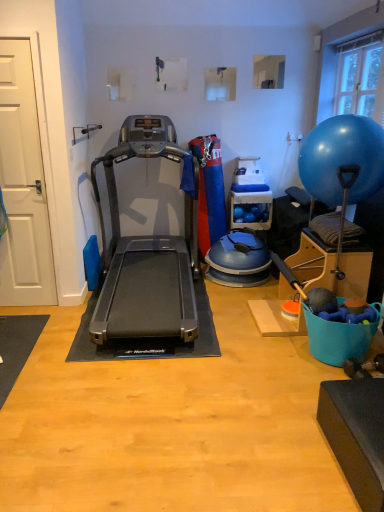
Find the location of a particular element. white matte door at left is located at coordinates (23, 183).

What is the approximate width of transparent glass window at upper right?

transparent glass window at upper right is 5.42 inches in width.

At what (x,y) coordinates should I click in order to perform the action: click on black rubber treadmill at center. Please return your answer as a coordinate pair (x, y). This screenshot has width=384, height=512. Looking at the image, I should click on (147, 249).

This screenshot has height=512, width=384. I want to click on blue rubber ball at right, so click(342, 158).

Does transparent glass window at upper right have a greater width compared to blue rubber ball at right?

In fact, transparent glass window at upper right might be narrower than blue rubber ball at right.

Who is taller, transparent glass window at upper right or blue rubber ball at right?

blue rubber ball at right is taller.

Who is smaller, transparent glass window at upper right or blue rubber ball at right?

With smaller size is transparent glass window at upper right.

From a real-world perspective, which is physically above, transparent glass window at upper right or blue rubber ball at right?

transparent glass window at upper right.

From the image's perspective, is blue rubber ball at right above or below white matte door at left?

Clearly, from the image's perspective, blue rubber ball at right is above white matte door at left.

From the picture: Is blue rubber ball at right not near white matte door at left?

That's right, there is a large distance between blue rubber ball at right and white matte door at left.

Would you say blue rubber ball at right is inside or outside white matte door at left?

blue rubber ball at right is spatially situated outside white matte door at left.

Based on the photo, is blue rubber ball at right in front of or behind white matte door at left in the image?

Visually, blue rubber ball at right is located in front of white matte door at left.

Who is shorter, black rubber treadmill at center or white matte door at left?

black rubber treadmill at center.

Is black rubber treadmill at center positioned beyond the bounds of white matte door at left?

black rubber treadmill at center lies outside white matte door at left's area.

In terms of size, does black rubber treadmill at center appear bigger or smaller than white matte door at left?

Clearly, black rubber treadmill at center is larger in size than white matte door at left.

Which is more to the right, black rubber treadmill at center or white matte door at left?

black rubber treadmill at center.

In the scene shown: Does blue rubber ball at right have a smaller size compared to transparent glass window at upper right?

Incorrect, blue rubber ball at right is not smaller in size than transparent glass window at upper right.

Which is nearer, (299, 174) or (335, 111)?

Point (299, 174)

From the picture: Does blue rubber ball at right have a greater height compared to transparent glass window at upper right?

Yes, blue rubber ball at right is taller than transparent glass window at upper right.

From the image's perspective, does blue rubber ball at right appear higher than transparent glass window at upper right?

No, from the image's perspective, blue rubber ball at right is not above transparent glass window at upper right.

Is transparent glass window at upper right not inside white matte door at left?

Yes, transparent glass window at upper right is outside of white matte door at left.

From the image's perspective, which object appears higher, transparent glass window at upper right or white matte door at left?

transparent glass window at upper right.

Is transparent glass window at upper right taller or shorter than white matte door at left?

transparent glass window at upper right is shorter than white matte door at left.

Based on the photo, would you say blue rubber ball at right is part of black rubber treadmill at center's contents?

Actually, blue rubber ball at right is outside black rubber treadmill at center.

Is black rubber treadmill at center turned away from blue rubber ball at right?

That's not correct — black rubber treadmill at center is not looking away from blue rubber ball at right.

From the image's perspective, would you say black rubber treadmill at center is shown under blue rubber ball at right?

Yes, from the image's perspective, black rubber treadmill at center is beneath blue rubber ball at right.

How many degrees apart are the facing directions of black rubber treadmill at center and blue rubber ball at right?

The angular difference between black rubber treadmill at center and blue rubber ball at right is 89.5 degrees.

From a real-world perspective, is transparent glass window at upper right below black rubber treadmill at center?

No, from a real-world perspective, transparent glass window at upper right is not below black rubber treadmill at center.

This screenshot has height=512, width=384. I want to click on treadmill directly beneath the transparent glass window at upper right (from a real-world perspective), so click(147, 249).

Is the surface of transparent glass window at upper right in direct contact with black rubber treadmill at center?

They are not placed beside each other.

Do you think transparent glass window at upper right is within black rubber treadmill at center, or outside of it?

transparent glass window at upper right exists outside the volume of black rubber treadmill at center.

This screenshot has height=512, width=384. I want to click on window screen on the right of blue rubber ball at right, so tap(357, 78).

Find the location of a particular element. door lying below the blue rubber ball at right (from the image's perspective) is located at coordinates (23, 183).

Looking at the image, which one is located further to transparent glass window at upper right, white matte door at left or blue rubber ball at right?

white matte door at left is further to transparent glass window at upper right.

Considering their positions, is transparent glass window at upper right positioned further to black rubber treadmill at center than blue rubber ball at right?

Among the two, transparent glass window at upper right is located further to black rubber treadmill at center.

When comparing their distances from transparent glass window at upper right, does black rubber treadmill at center or blue rubber ball at right seem further?

black rubber treadmill at center is positioned further to the anchor transparent glass window at upper right.

Which object lies nearer to the anchor point blue rubber ball at right, black rubber treadmill at center or white matte door at left?

black rubber treadmill at center is positioned closer to the anchor blue rubber ball at right.

When comparing their distances from black rubber treadmill at center, does transparent glass window at upper right or white matte door at left seem closer?

white matte door at left lies closer to black rubber treadmill at center than the other object.

Looking at the image, which one is located further to black rubber treadmill at center, blue rubber ball at right or transparent glass window at upper right?

transparent glass window at upper right is positioned further to the anchor black rubber treadmill at center.

When comparing their distances from blue rubber ball at right, does white matte door at left or transparent glass window at upper right seem closer?

Among the two, transparent glass window at upper right is located nearer to blue rubber ball at right.

Considering their positions, is blue rubber ball at right positioned closer to white matte door at left than black rubber treadmill at center?

Among the two, black rubber treadmill at center is located nearer to white matte door at left.

Image resolution: width=384 pixels, height=512 pixels. Find the location of `ball between white matte door at left and transparent glass window at upper right`. ball between white matte door at left and transparent glass window at upper right is located at coordinates (342, 158).

At what (x,y) coordinates should I click in order to perform the action: click on ball between black rubber treadmill at center and transparent glass window at upper right. Please return your answer as a coordinate pair (x, y). Looking at the image, I should click on (342, 158).

Locate an element on the screen. Image resolution: width=384 pixels, height=512 pixels. treadmill situated between white matte door at left and transparent glass window at upper right from left to right is located at coordinates (147, 249).

Find the location of a particular element. The image size is (384, 512). treadmill between white matte door at left and blue rubber ball at right is located at coordinates (147, 249).